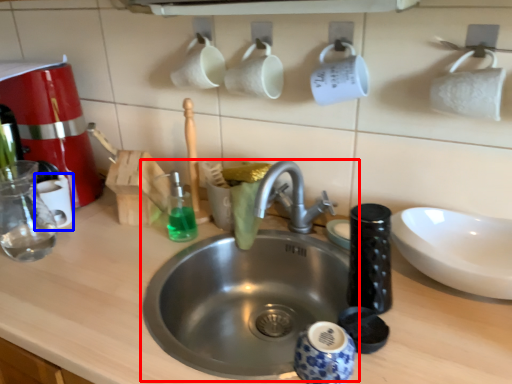
Question: Which object is further to the camera taking this photo, sink (highlighted by a red box) or mug (highlighted by a blue box)?

Choices:
 (A) sink
 (B) mug

Answer: (B)